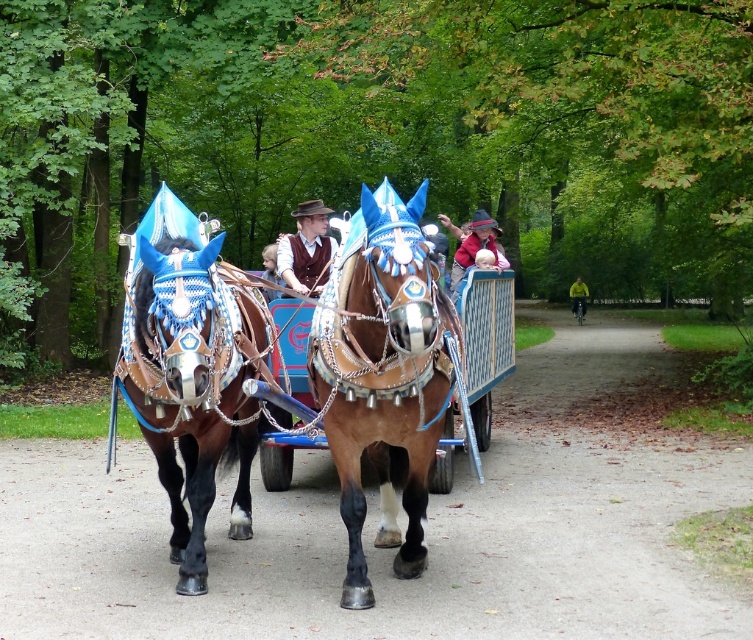
Between brown shiny horse at center and brown leather harness at center, which one appears on the left side from the viewer's perspective?

Positioned to the left is brown leather harness at center.

Does point (377, 340) come behind point (127, 378)?

No.

Identify the location of brown shiny horse at center. (383, 372).

Between point (437, 371) and point (459, 262), which one is positioned behind?

The point (459, 262) is more distant.

Who is taller, brown shiny horse at center or matte brown leather jacket at center?

brown shiny horse at center

The height and width of the screenshot is (640, 753). I want to click on brown shiny horse at center, so click(383, 372).

Is shiny brown cart at center smaller than brown leather harness at center?

Yes.

Locate an element on the screen. This screenshot has height=640, width=753. shiny brown cart at center is located at coordinates (386, 371).

Identify the location of shiny brown cart at center. (386, 371).